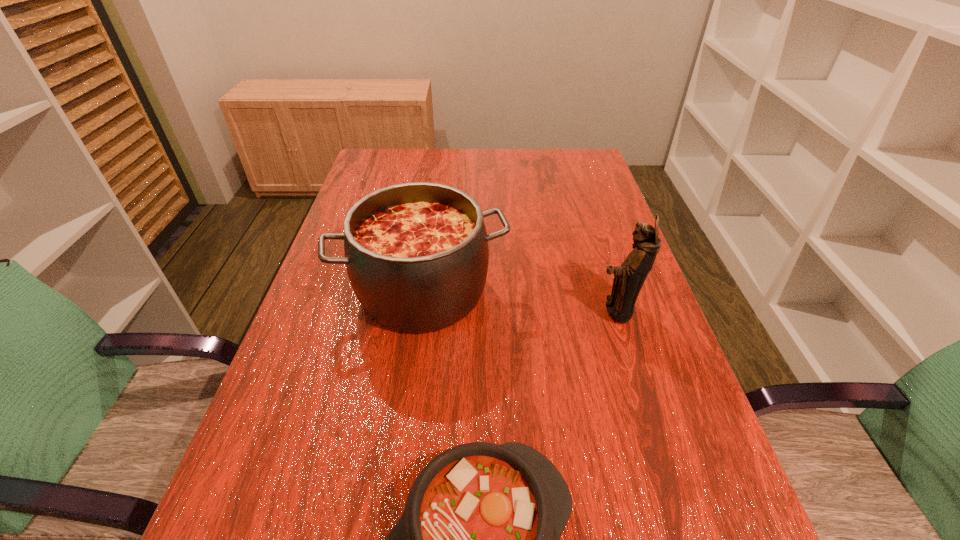
This screenshot has height=540, width=960. Identify the location of free spot at the far edge of the desktop. (468, 161).

Find the location of a particular element. This screenshot has height=540, width=960. vacant space at the left edge of the desktop is located at coordinates (302, 332).

The image size is (960, 540). Identify the location of vacant region at the right edge of the desktop. (562, 195).

Identify the location of vacant area at the far left corner of the desktop. The height and width of the screenshot is (540, 960). (403, 179).

The width and height of the screenshot is (960, 540). Identify the location of free space between the second tallest object and the rightmost object. (519, 301).

Find the location of `vacant space in between the taller casserole and the tallest object`. vacant space in between the taller casserole and the tallest object is located at coordinates (519, 301).

This screenshot has height=540, width=960. I want to click on free space between the second shortest object and the rightmost object, so click(x=519, y=301).

This screenshot has width=960, height=540. Identify the location of the closest object relative to the shortest object. (417, 254).

Find the location of a particular element. The image size is (960, 540). object that is the second closest one to the nearest object is located at coordinates (629, 278).